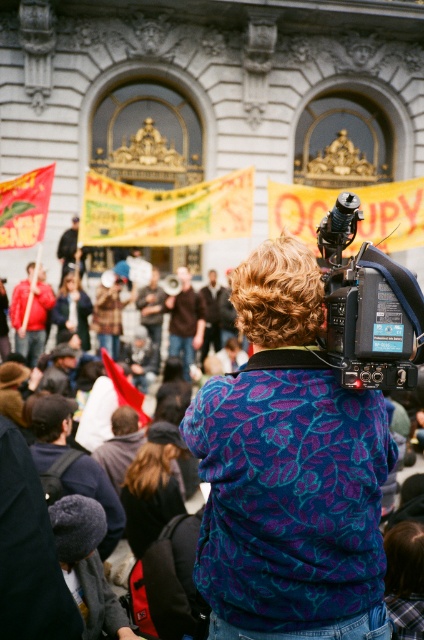
Question: Which of the following is the farthest from the observer?

Choices:
 (A) (222, 554)
 (B) (125, 202)

Answer: (B)

Question: Does purple leaf-patterned sweater at center have a smaller size compared to yellow/yellowish paper banner at upper center?

Choices:
 (A) yes
 (B) no

Answer: (B)

Question: Which point is farther from the camera taking this photo?

Choices:
 (A) (247, 282)
 (B) (337, 282)
 (C) (245, 209)

Answer: (C)

Question: Among these objects, which one is nearest to the camera?

Choices:
 (A) black plastic video camera at upper right
 (B) purple leaf-patterned sweater at center

Answer: (A)

Question: In this image, where is purple leaf-patterned sweater at center located relative to black plastic video camera at upper right?

Choices:
 (A) below
 (B) above

Answer: (A)

Question: Does purple leaf-patterned sweater at center have a smaller size compared to yellow/yellowish paper banner at upper center?

Choices:
 (A) no
 (B) yes

Answer: (A)